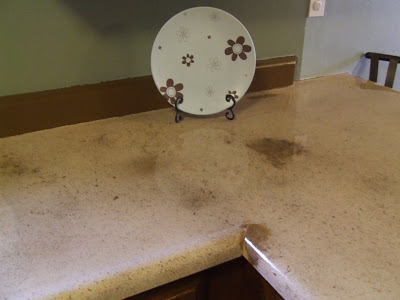
This screenshot has width=400, height=300. I want to click on outlet, so click(316, 6).